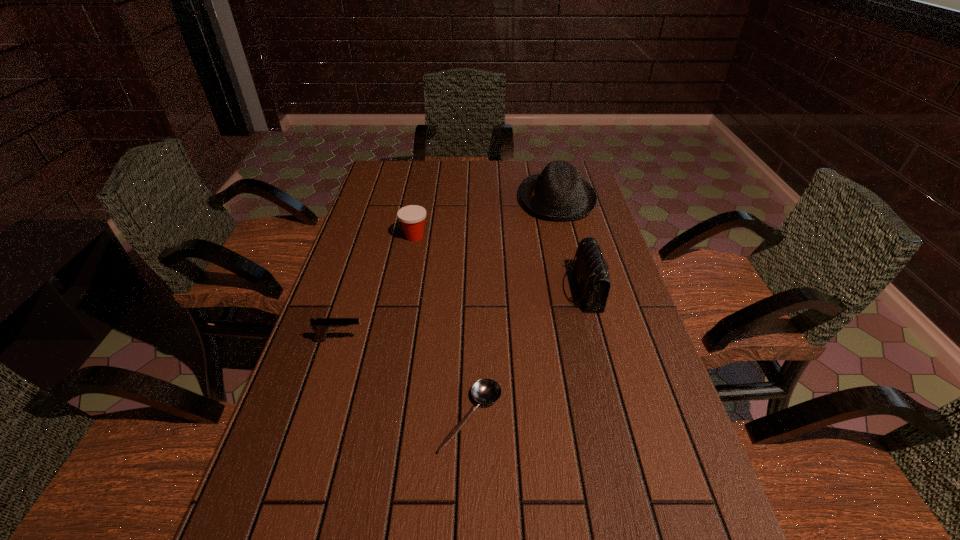
Locate an element on the screen. free area in between the second shortest object and the nearest object is located at coordinates (405, 379).

Identify the location of free area in between the third farthest object and the leftmost object. (461, 315).

The width and height of the screenshot is (960, 540). What are the coordinates of `vacant space that is in between the leftmost object and the fedora` in the screenshot? It's located at (448, 270).

This screenshot has height=540, width=960. Identify the location of vacant space in between the fedora and the second farthest object. click(x=486, y=218).

I want to click on vacant area between the fourth tallest object and the ladle, so click(x=405, y=379).

Identify the location of empty space that is in between the ladle and the fourth tallest object. The width and height of the screenshot is (960, 540). (405, 379).

Locate an element on the screen. The height and width of the screenshot is (540, 960). vacant area that lies between the second object from left to right and the clutch bag is located at coordinates (498, 264).

This screenshot has width=960, height=540. What are the coordinates of `vacant region between the ladle and the second farthest object` in the screenshot? It's located at (443, 327).

The image size is (960, 540). Find the location of `object identified as the closest to the farthest object`. object identified as the closest to the farthest object is located at coordinates (591, 272).

Choose which object is the second nearest neighbor to the fedora. Please provide its 2D coordinates. Your answer should be formatted as a tuple, i.e. [(x, y)], where the tuple contains the x and y coordinates of a point satisfying the conditions above.

[(412, 217)]